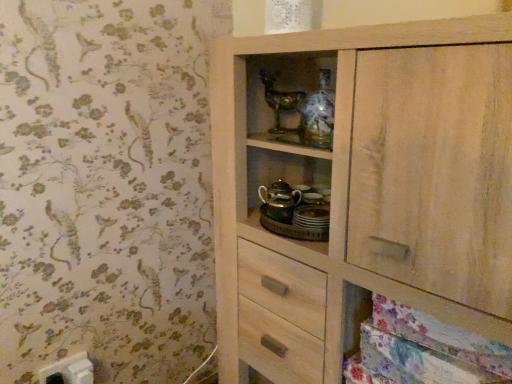
Where is `natural wood cupboard at center`? The image size is (512, 384). natural wood cupboard at center is located at coordinates (364, 190).

What do you see at coordinates (364, 190) in the screenshot?
I see `natural wood cupboard at center` at bounding box center [364, 190].

Measure the distance between point (341, 194) and camera.

Point (341, 194) is 35.35 inches from camera.

At what (x,y) coordinates should I click in order to perform the action: click on natural wood cupboard at center. Please return your answer as a coordinate pair (x, y). The image size is (512, 384). Looking at the image, I should click on (364, 190).